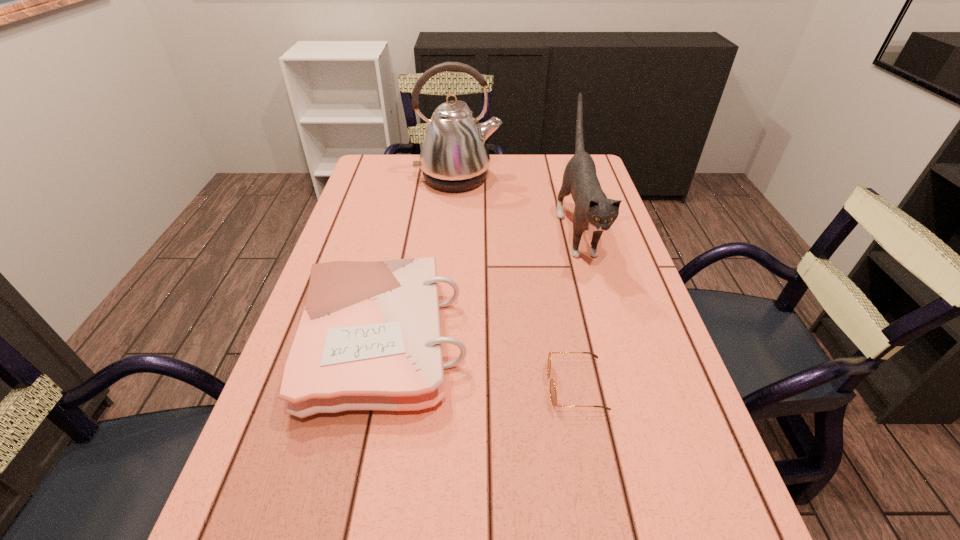
At what (x,y) coordinates should I click in order to perform the action: click on kettle present at the far edge. Please return your answer as a coordinate pair (x, y). Looking at the image, I should click on (454, 157).

This screenshot has width=960, height=540. I want to click on cat that is at the far edge, so click(593, 211).

The image size is (960, 540). Find the location of `object that is at the left edge`. object that is at the left edge is located at coordinates (369, 338).

The height and width of the screenshot is (540, 960). What are the coordinates of `cat situated at the right edge` in the screenshot? It's located at (593, 211).

Where is `sunglasses that is positioned at the right edge`? sunglasses that is positioned at the right edge is located at coordinates (553, 394).

You are a GUI agent. You are given a task and a screenshot of the screen. Output one action in this format:
    pyautogui.click(x=<x>, y=<y>)
    Task: Click on the object positioned at the far right corner
    
    Given the screenshot: What is the action you would take?
    pyautogui.click(x=593, y=211)

You are a GUI agent. You are given a task and a screenshot of the screen. Output one action in this format:
    pyautogui.click(x=<x>, y=<y>)
    Task: Click on the free space at the far edge
    This screenshot has height=540, width=960.
    Given the screenshot: What is the action you would take?
    pyautogui.click(x=540, y=157)

In order to click on free spot at the left edge of the desktop in this screenshot , I will do `click(358, 226)`.

Where is `vacant space at the right edge of the desktop`? vacant space at the right edge of the desktop is located at coordinates (567, 210).

Image resolution: width=960 pixels, height=540 pixels. I want to click on free space at the far left corner of the desktop, so click(x=373, y=180).